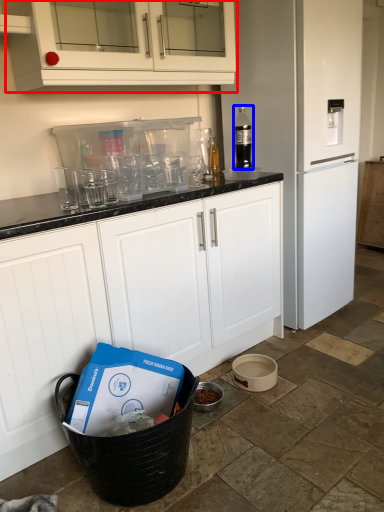
Question: Which of the following is the closest to the observer, cabinetry (highlighted by a red box) or bottle (highlighted by a blue box)?

Choices:
 (A) cabinetry
 (B) bottle

Answer: (A)